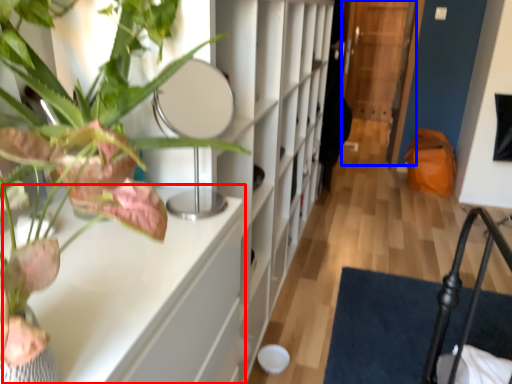
Question: Which object is further to the camera taking this photo, table (highlighted by a red box) or glass door (highlighted by a blue box)?

Choices:
 (A) table
 (B) glass door

Answer: (B)